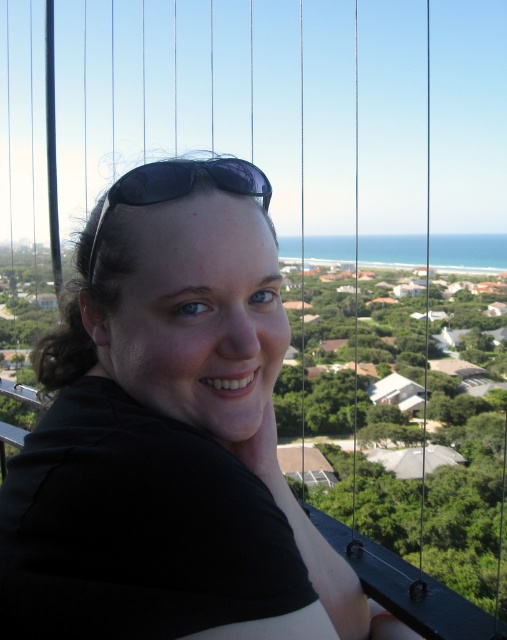
You are a photographer trying to capture the scenic coastal view behind the person wearing the black matte shirt at center. To ensure the background is in focus, you need to know the distance between the person and the nearest house in the background. Can you determine if the distance is more than 50 meters?

The black matte shirt at center is located at point (169, 435). However, without specific information about the nearest house location or the actual distance between them, I cannot determine if the distance exceeds 50 meters.

You are a photographer trying to capture a portrait of the person wearing the black matte shirt at center and the black matte sunglasses at center. Since the shirt is taller than the sunglasses, which object should you focus on first to ensure it appears in focus?

The black matte shirt at center is taller than the black matte sunglasses at center, so you should focus on the black matte shirt at center first to ensure it appears in focus.

Consider the image. You are standing on a balcony and want to know how far you are from the point at coordinates point (262, 368). Can you determine the distance?

The distance between you and point (262, 368) is 43.53 meters.